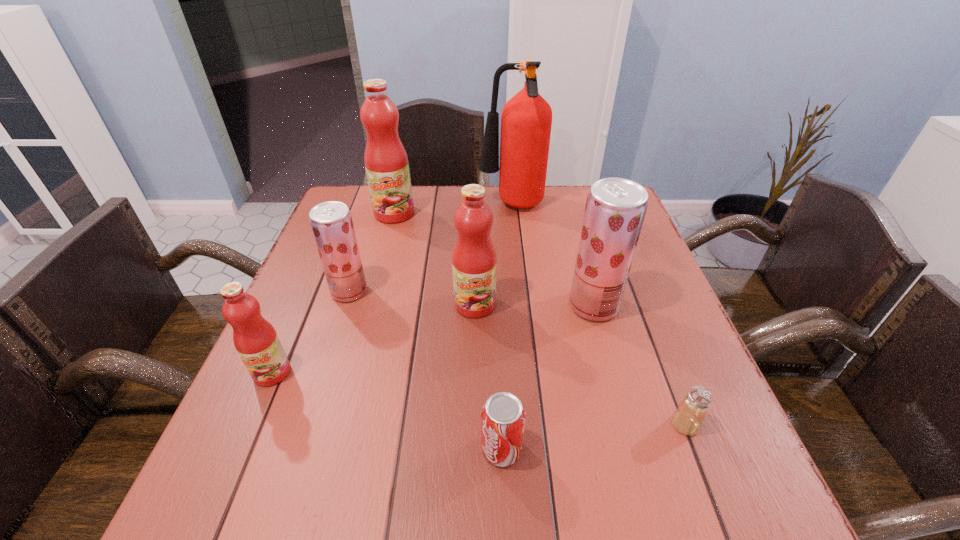
Locate an element on the screen. The width and height of the screenshot is (960, 540). free area in between the second biggest pink fruit juice and the rightmost object is located at coordinates [580, 364].

Where is `free point between the leftmost fruit juice and the smaller strawberry fruit juice`? free point between the leftmost fruit juice and the smaller strawberry fruit juice is located at coordinates (311, 332).

I want to click on blank region between the seventh object from left to right and the nearest fruit juice, so click(433, 339).

Locate which object is the second closest to the farthest pink fruit juice. Please provide its 2D coordinates. Your answer should be formatted as a tuple, i.e. [(x, y)], where the tuple contains the x and y coordinates of a point satisfying the conditions above.

[(331, 222)]

At what (x,y) coordinates should I click in order to perform the action: click on object that is the closest to the leftmost fruit juice. Please return your answer as a coordinate pair (x, y). Looking at the image, I should click on (331, 222).

Locate an element on the screen. fruit juice that is the second closest to the soda can is located at coordinates (615, 209).

Locate which fruit juice ranks third in proximity to the second pink fruit juice from right to left. Please provide its 2D coordinates. Your answer should be formatted as a tuple, i.e. [(x, y)], where the tuple contains the x and y coordinates of a point satisfying the conditions above.

[(615, 209)]

Locate which pink fruit juice ranks in proximity to the rightmost pink fruit juice. Please provide its 2D coordinates. Your answer should be formatted as a tuple, i.e. [(x, y)], where the tuple contains the x and y coordinates of a point satisfying the conditions above.

[(386, 162)]

Find the location of a particular element. The image size is (960, 540). pink fruit juice that is the third closest to the left strawberry fruit juice is located at coordinates (386, 162).

The image size is (960, 540). In order to click on blank area in the image that satisfies the following two spatial constraints: 1. at the nozzle of the red fire extinguisher; 2. on the front label of the nearest pink fruit juice in this screenshot , I will do [x=528, y=373].